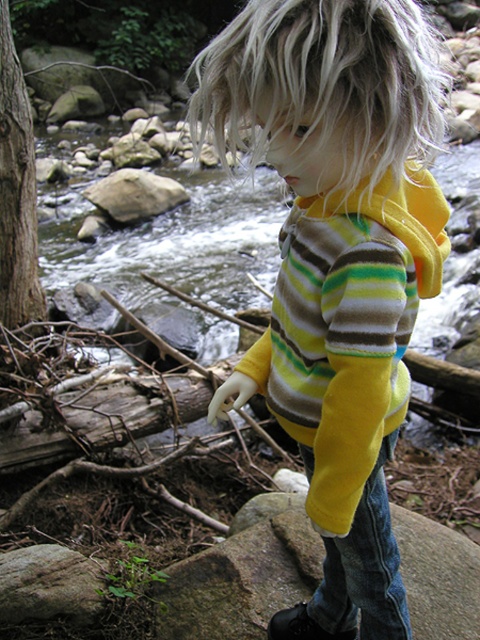
Based on the coordinates provided, where exactly is the blondehair at center located in the image?

The blondehair at center is located at coordinates point (324, 83).

You are a photographer wanting to capture a closeup shot of the yellow fleece hoodie at center. Your camera has a minimum focusing distance of 30 inches. Can you take the photo without moving the hoodie?

The yellow fleece hoodie at center is 31.01 inches away from the viewer, which is slightly beyond the camera minimum focusing distance of 30 inches. Therefore, you cannot take the photo without moving the hoodie closer.